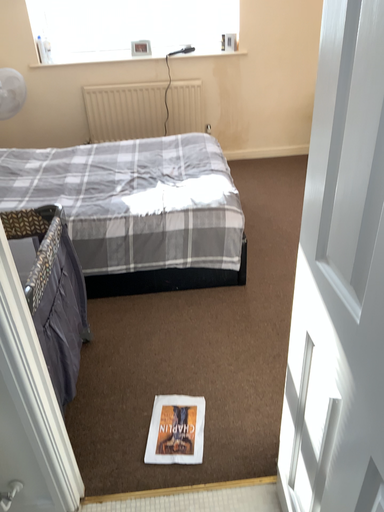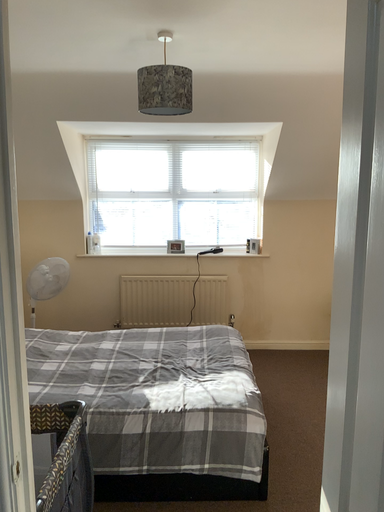
Question: How did the camera likely rotate when shooting the video?

Choices:
 (A) rotated upward
 (B) rotated downward

Answer: (A)